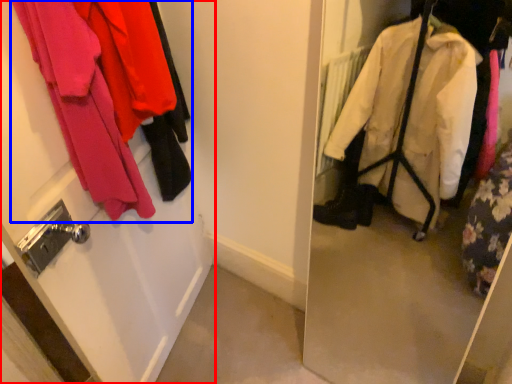
Question: Which point is closer to the camera, door (highlighted by a red box) or closet (highlighted by a blue box)?

Choices:
 (A) door
 (B) closet

Answer: (A)